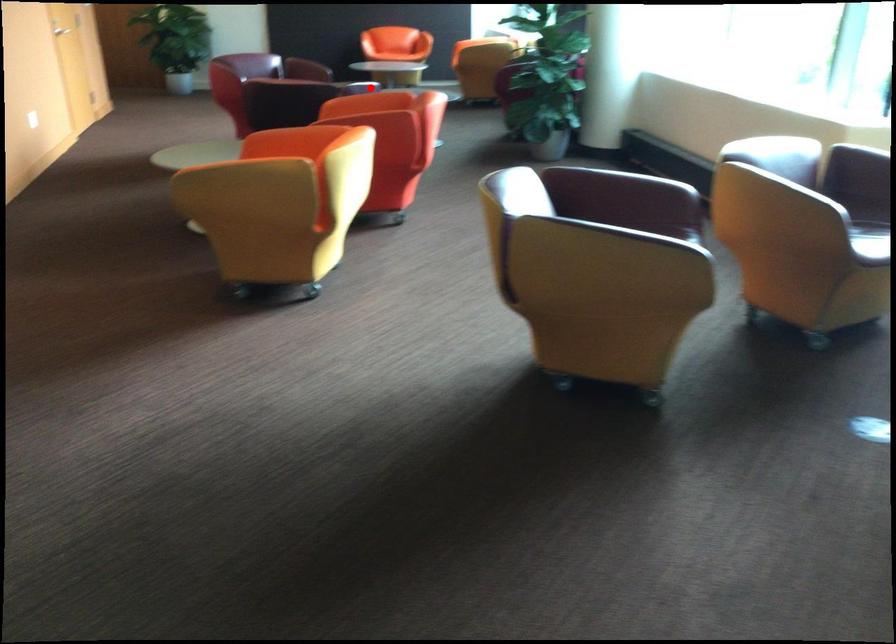
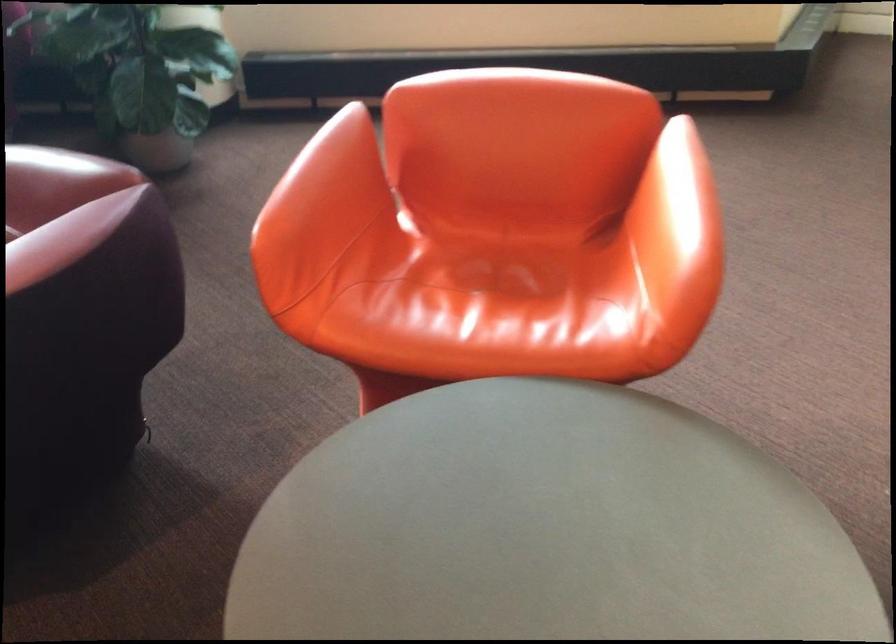
Find the pixel in the second image that matches the highlighted location in the first image.

(321, 192)